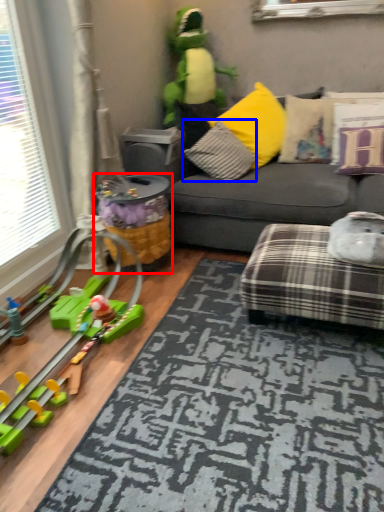
Question: Which object is further to the camera taking this photo, toy (highlighted by a red box) or pillow (highlighted by a blue box)?

Choices:
 (A) toy
 (B) pillow

Answer: (B)